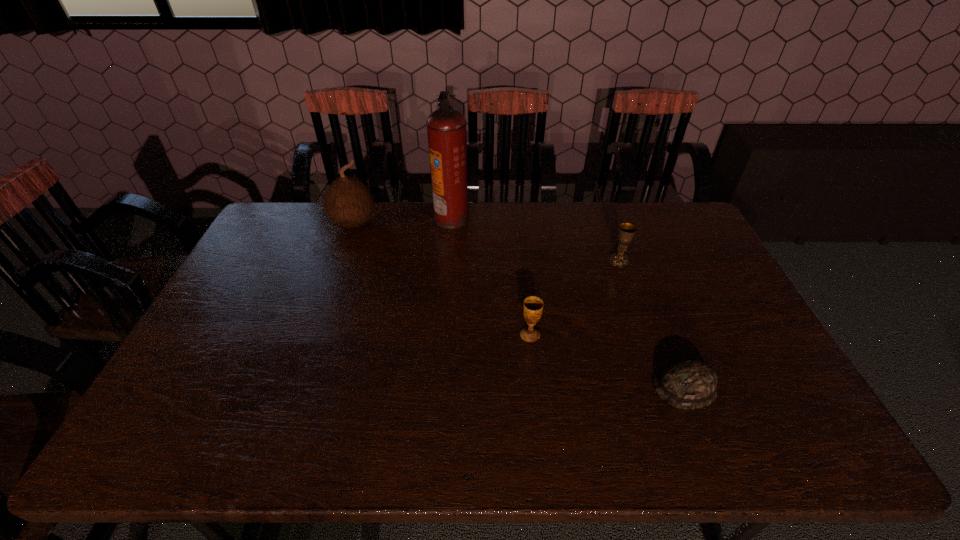
At what (x,y) coordinates should I click in order to perform the action: click on vacant space at the near left corner. Please return your answer as a coordinate pair (x, y). The image size is (960, 540). Looking at the image, I should click on (140, 452).

Locate an element on the screen. vacant space at the far right corner of the desktop is located at coordinates (661, 205).

Find the location of `free spot between the third object from right to left and the second tallest object`. free spot between the third object from right to left and the second tallest object is located at coordinates (442, 279).

Locate an element on the screen. This screenshot has height=540, width=960. vacant point located between the left chalice and the shortest object is located at coordinates (608, 361).

I want to click on free spot between the third object from left to right and the right chalice, so tap(574, 298).

Locate an element on the screen. Image resolution: width=960 pixels, height=540 pixels. vacant space in between the leftmost object and the tallest object is located at coordinates (403, 220).

The image size is (960, 540). I want to click on unoccupied area between the coconut and the left chalice, so coord(442,279).

This screenshot has width=960, height=540. In order to click on free space that is in between the coconut and the farther chalice in this screenshot , I will do `click(487, 241)`.

You are a GUI agent. You are given a task and a screenshot of the screen. Output one action in this format:
    pyautogui.click(x=<x>, y=<y>)
    Task: Click on the free point between the coconut and the right chalice
    
    Given the screenshot: What is the action you would take?
    pyautogui.click(x=487, y=241)

The height and width of the screenshot is (540, 960). In order to click on free spot between the nearest object and the fire extinguisher in this screenshot , I will do `click(568, 302)`.